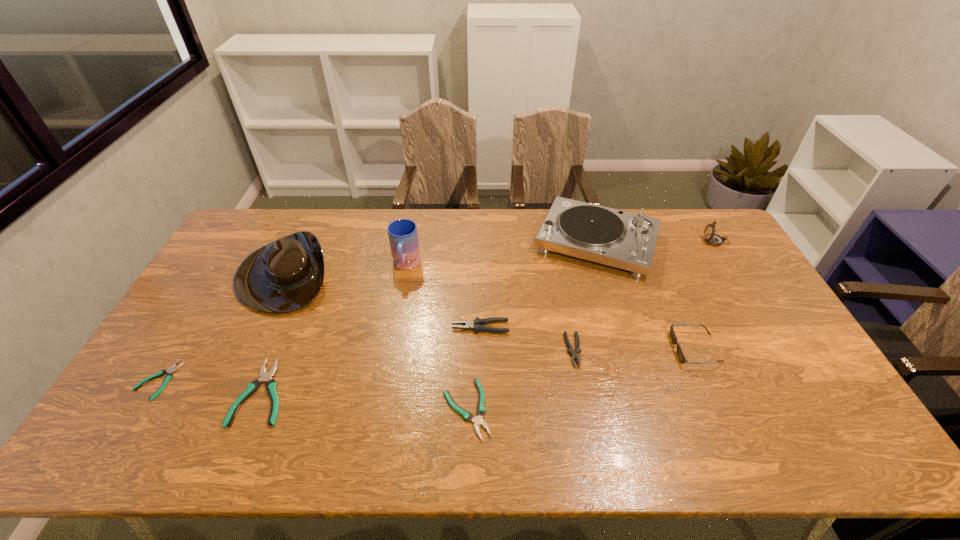
Where is `free space located 0.220m on the face of the compass`? free space located 0.220m on the face of the compass is located at coordinates (641, 241).

In order to click on vacant space located on the face of the compass in this screenshot , I will do `click(666, 241)`.

Image resolution: width=960 pixels, height=540 pixels. I want to click on vacant space located on the front of the cowboy hat, so click(x=259, y=331).

At what (x,y) coordinates should I click in order to perform the action: click on vacant area located on the front-facing side of the sunglasses. Please return your answer as a coordinate pair (x, y). This screenshot has width=960, height=540. Looking at the image, I should click on (631, 349).

In order to click on vacant region located 0.390m on the front-facing side of the sunglasses in this screenshot , I will do `click(536, 349)`.

Where is `free spot located on the front-facing side of the sunglasses`? Image resolution: width=960 pixels, height=540 pixels. free spot located on the front-facing side of the sunglasses is located at coordinates (624, 349).

Find the location of a particular element. vacant space positioned 0.340m at the gripping part of the left gray pliers is located at coordinates (337, 327).

You are a GUI agent. You are given a task and a screenshot of the screen. Output one action in this format:
    pyautogui.click(x=<x>, y=<y>)
    Task: Click on the vacant point located 0.370m at the gripping part of the left gray pliers
    
    Given the screenshot: What is the action you would take?
    coord(326,327)

Identify the location of free space located at the gripping part of the left gray pliers. This screenshot has height=540, width=960. (421, 327).

You are a GUI agent. You are given a task and a screenshot of the screen. Output one action in this format:
    pyautogui.click(x=<x>, y=<y>)
    Task: Click on the free space located at the gripping part of the smaller gray pliers
    Image resolution: width=960 pixels, height=540 pixels.
    Given the screenshot: What is the action you would take?
    pyautogui.click(x=593, y=457)